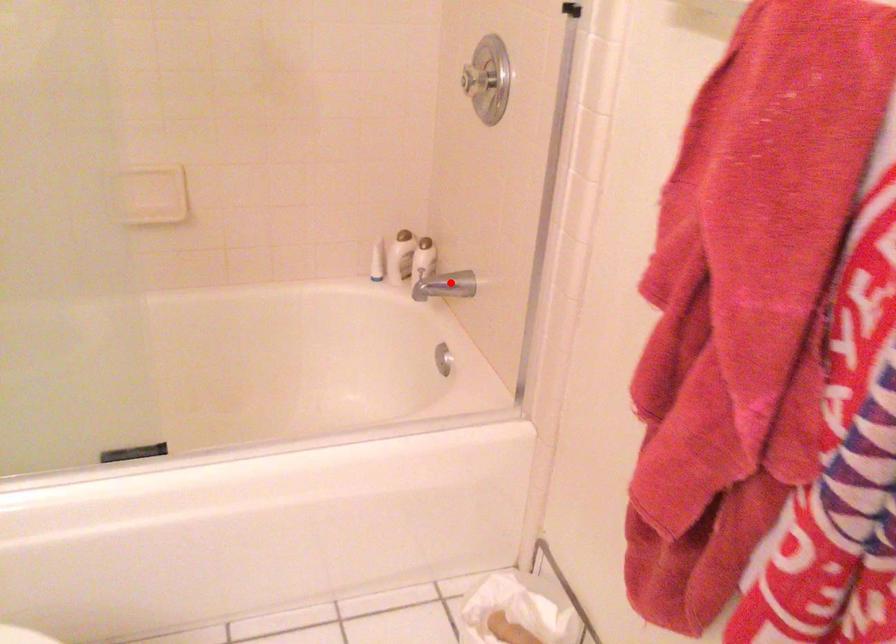
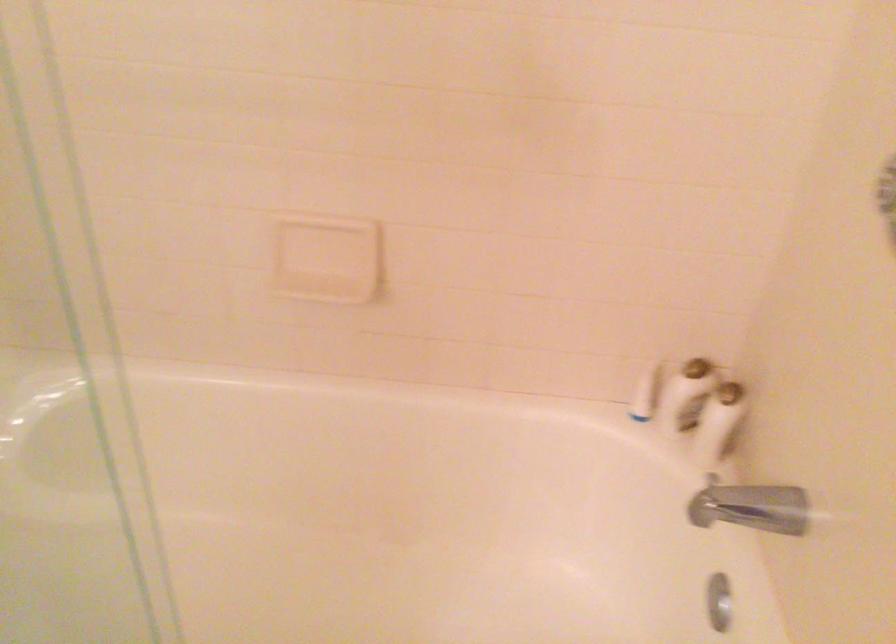
Find the pixel in the second image that matches the highlighted location in the first image.

(757, 507)